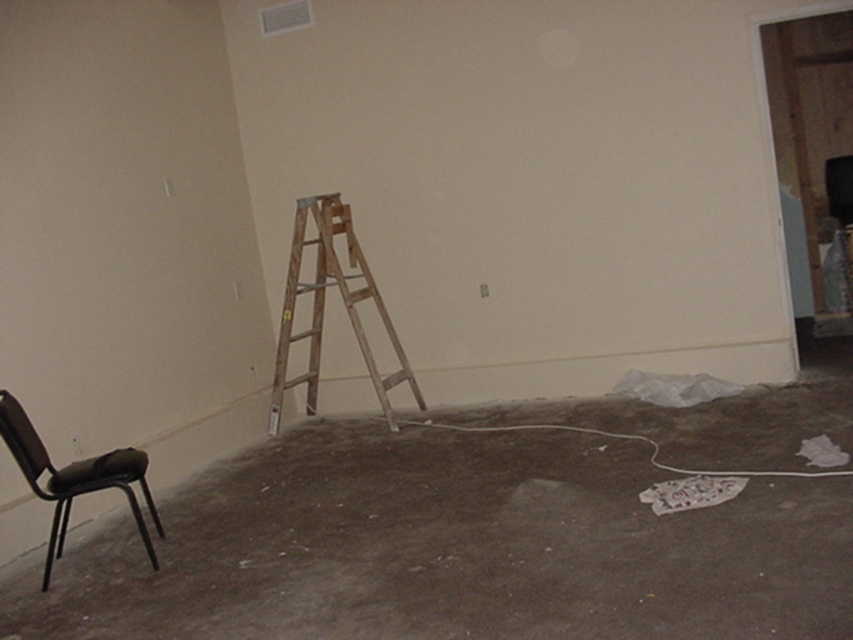
You are a painter needing to reach a high ceiling. You see the wooden ladder at center and the brown leather chair at lower left. Which object should you use to stand on to reach the ceiling?

You should use the wooden ladder at center because it has a larger size compared to the brown leather chair at lower left, making it more suitable for reaching high places.

You are a painter standing at the origin point of the coordinate system in the image. You need to place a new electrical outlet at the point marked as point (323, 307). Is there already an object at that location?

The wooden ladder at center is located at point (323, 307), so there is already an object at that location.

You are standing in the middle of the room and want to reach the point marked at coordinates (390, 428). The room is 6 meters long from front to back. Can you walk straight to that point without needing to adjust your path?

The distance of point (390, 428) from camera is 5.67 meters. Since the room is 6 meters long, you can walk straight to the point as it is within the room length.